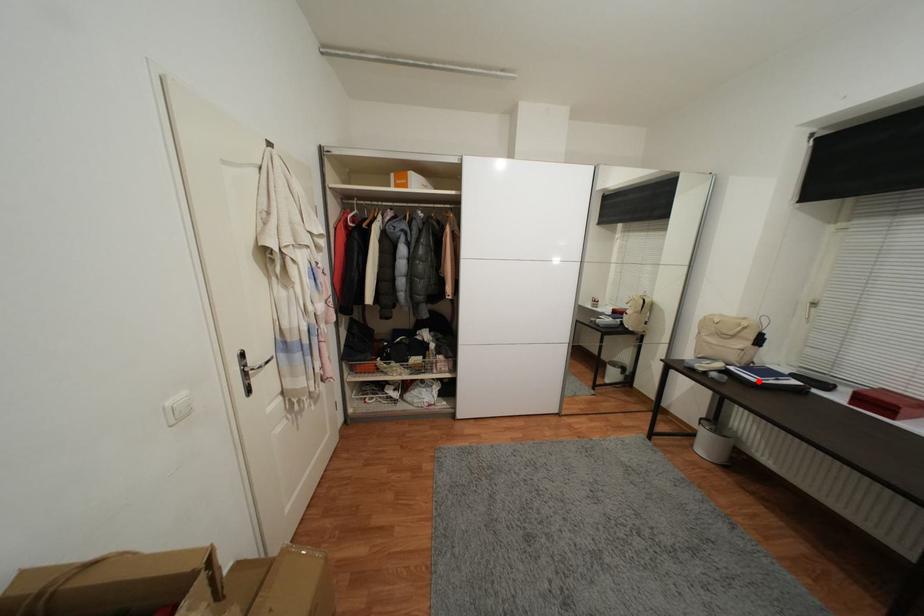
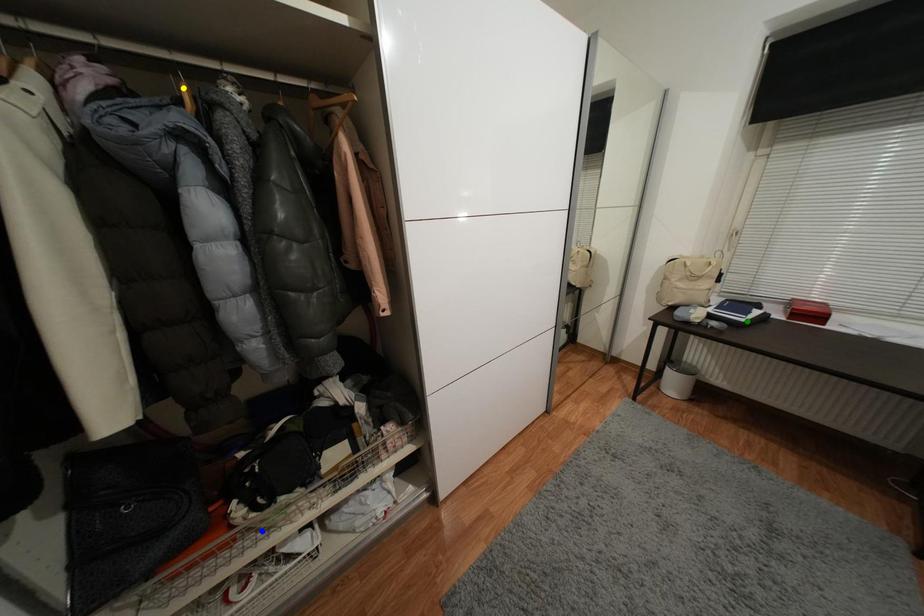
Question: I am providing you with two images of the same scene from different viewpoints. A red point is marked on the first image. You are given multiple points on the second image. Which point in image 2 is actually the same real-world point as the red point in image 1?

Choices:
 (A) blue point
 (B) green point
 (C) yellow point

Answer: (B)